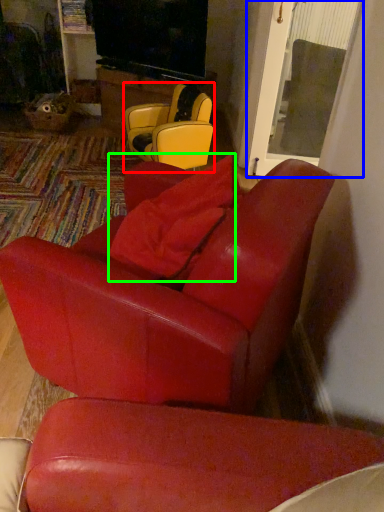
Question: Considering the real-world distances, which object is closest to chair (highlighted by a red box)? glass door (highlighted by a blue box) or pillow (highlighted by a green box).

Choices:
 (A) glass door
 (B) pillow

Answer: (A)